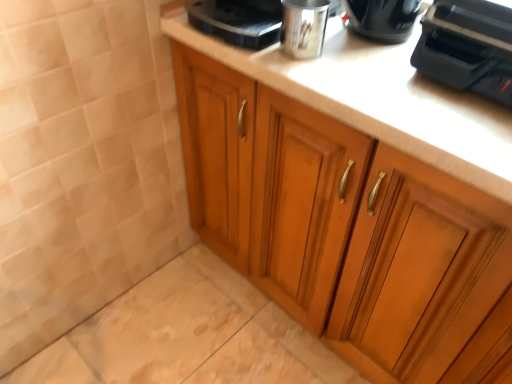
Where is `vacant space to the left of black plastic toaster at upper right`? The image size is (512, 384). vacant space to the left of black plastic toaster at upper right is located at coordinates (372, 83).